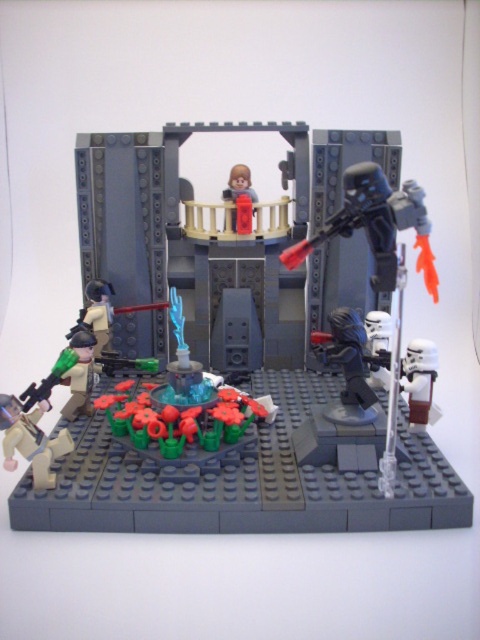
Question: Based on their relative distances, which object is farther from the translucent plastic stormtrooper at upper right?

Choices:
 (A) smooth red figure at upper center
 (B) light brown plastic figure at lower left

Answer: (B)

Question: Can you confirm if translucent plastic stormtrooper at upper right is bigger than light brown plastic figure at lower left?

Choices:
 (A) yes
 (B) no

Answer: (A)

Question: Which point is closer to the camera?

Choices:
 (A) (6, 400)
 (B) (239, 195)
 (C) (147, 470)

Answer: (A)

Question: Does light brown plastic figure at lower left have a lesser width compared to smooth red figure at upper center?

Choices:
 (A) no
 (B) yes

Answer: (A)

Question: Can you confirm if light brown plastic figure at lower left is smaller than smooth red figure at upper center?

Choices:
 (A) no
 (B) yes

Answer: (A)

Question: Among these points, which one is nearest to the camera?

Choices:
 (A) (231, 211)
 (B) (44, 406)

Answer: (B)